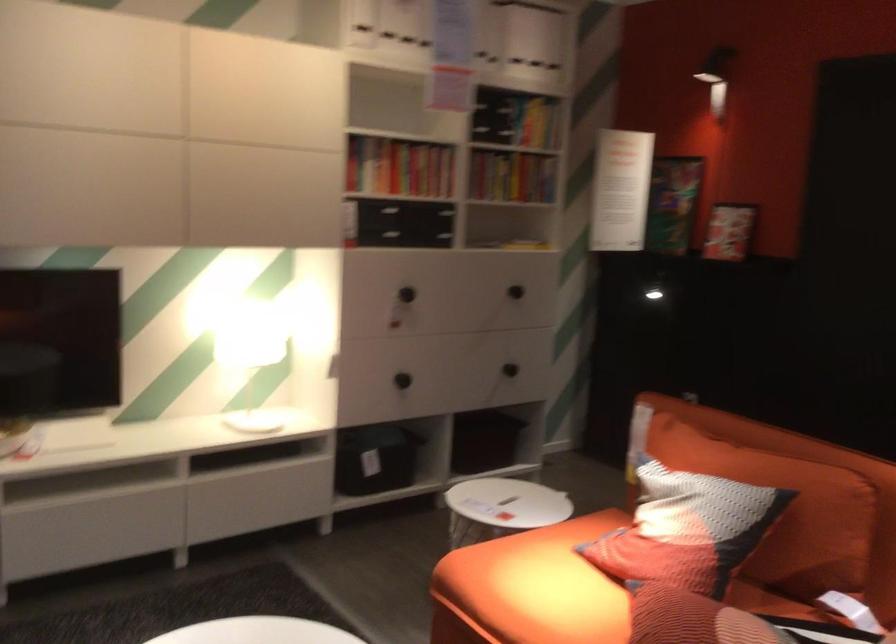
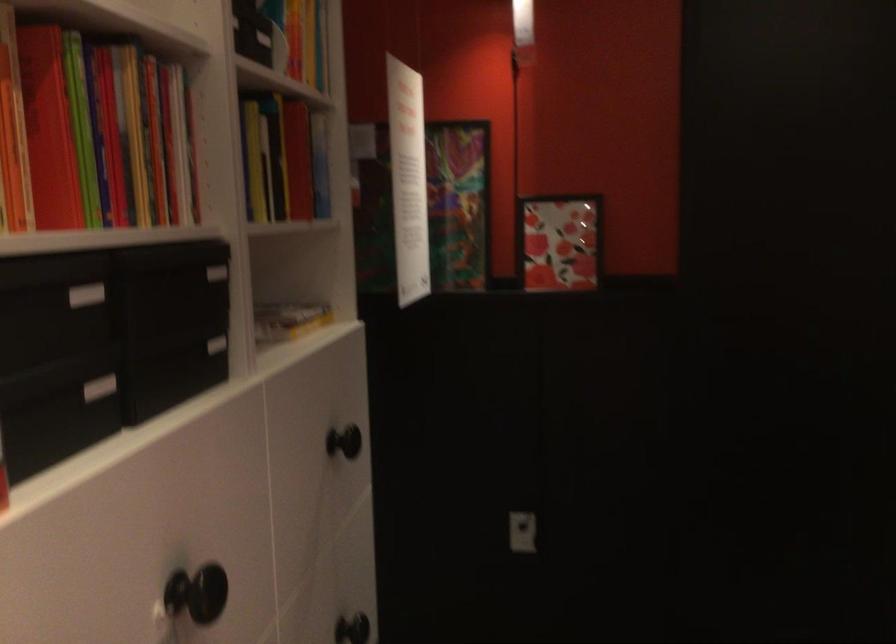
The point at (552,106) is marked in the first image. Where is the corresponding point in the second image?

(309, 49)